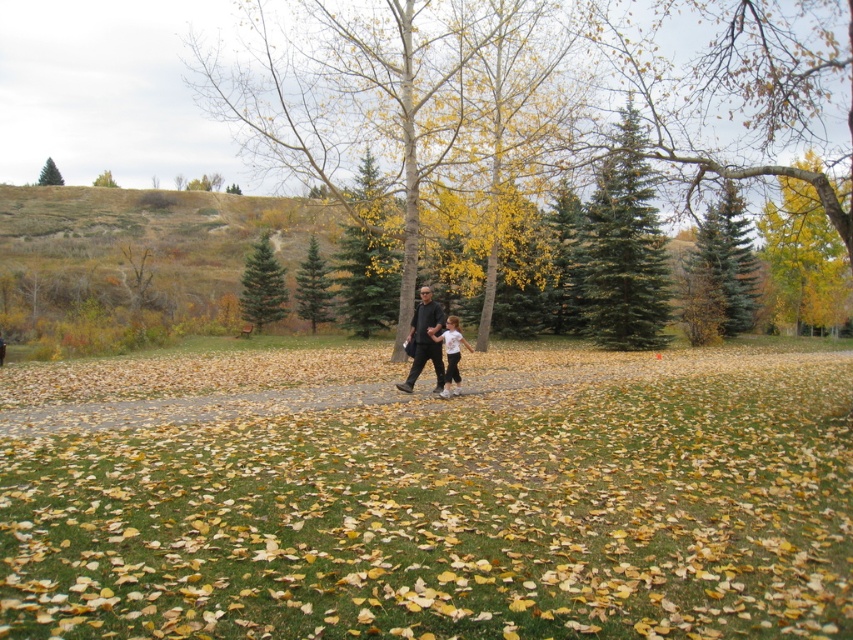
Is green fir tree at center thinner than matte black clothing at center?

Yes.

Can you confirm if green fir tree at center is wider than matte black clothing at center?

No, green fir tree at center is not wider than matte black clothing at center.

Describe the element at coordinates (262, 285) in the screenshot. I see `green fir tree at center` at that location.

Where is `green fir tree at center`? green fir tree at center is located at coordinates (262, 285).

Looking at this image, is green fir tree at center wider than green leafy tree at upper center?

No, green fir tree at center is not wider than green leafy tree at upper center.

Between green fir tree at center and green leafy tree at upper center, which one has more height?

green leafy tree at upper center

Does point (251, 264) come behind point (103, 170)?

No, it is not.

Image resolution: width=853 pixels, height=640 pixels. Identify the location of green fir tree at center. (262, 285).

Is white matte shirt at center behind green matte tree at upper left?

No, white matte shirt at center is closer to the viewer.

Who is higher up, white matte shirt at center or green matte tree at upper left?

green matte tree at upper left is above.

Find the location of a particular element. white matte shirt at center is located at coordinates (451, 353).